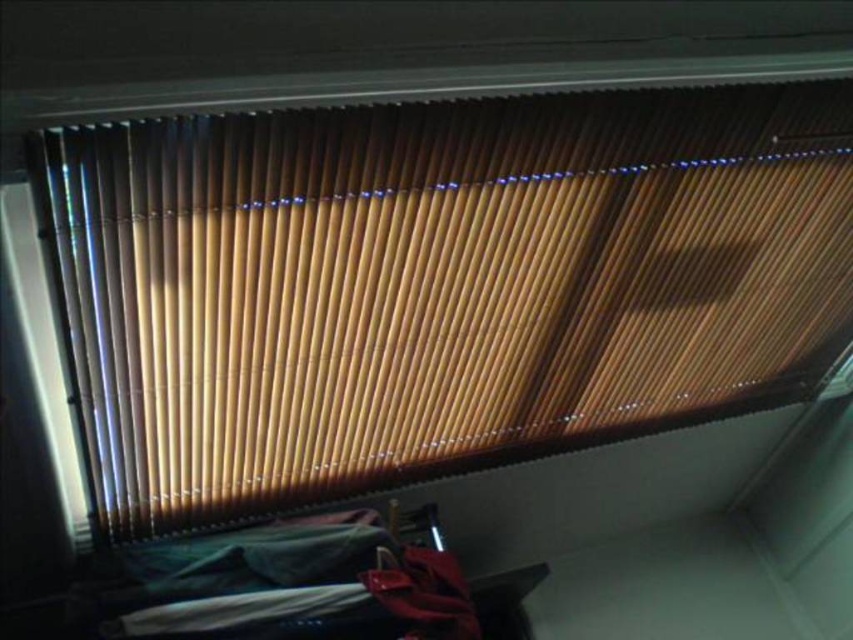
You are standing in the room and want to determine which object is taller between the wooden blinds at upper center and the velvet green bed at lower center. Based on the scene, which one is taller?

The wooden blinds at upper center has a greater height compared to the velvet green bed at lower center, so the wooden blinds at upper center is taller.

You are trying to decide whether to move the velvet green bed at lower center closer to the wooden blinds at upper center. Considering their sizes, would moving the bed closer make the space feel more cramped?

The wooden blinds at upper center are larger in size than the velvet green bed at lower center. Moving the velvet green bed at lower center closer to the wooden blinds at upper center would likely make the space feel more cramped because the bed is smaller and the blinds are already taking up more space.